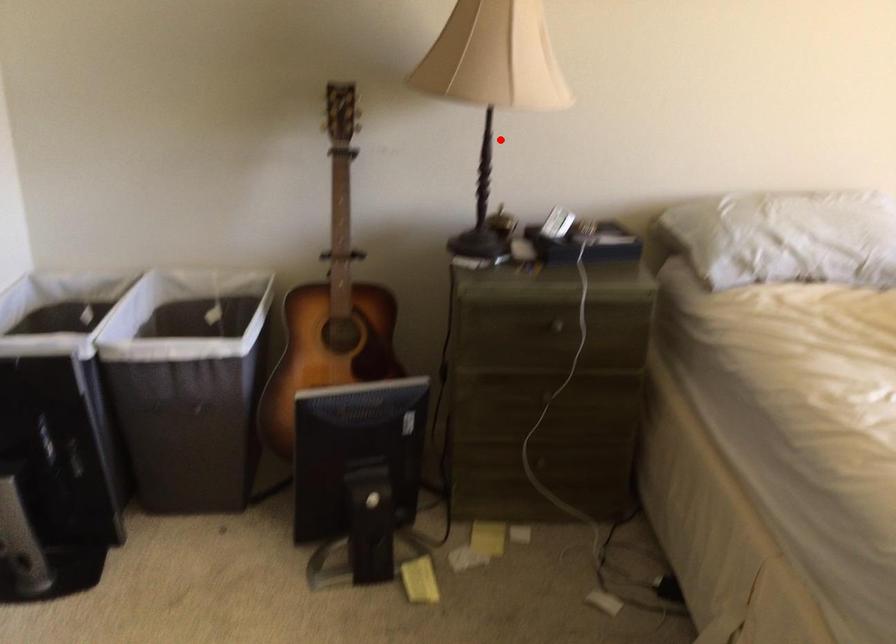
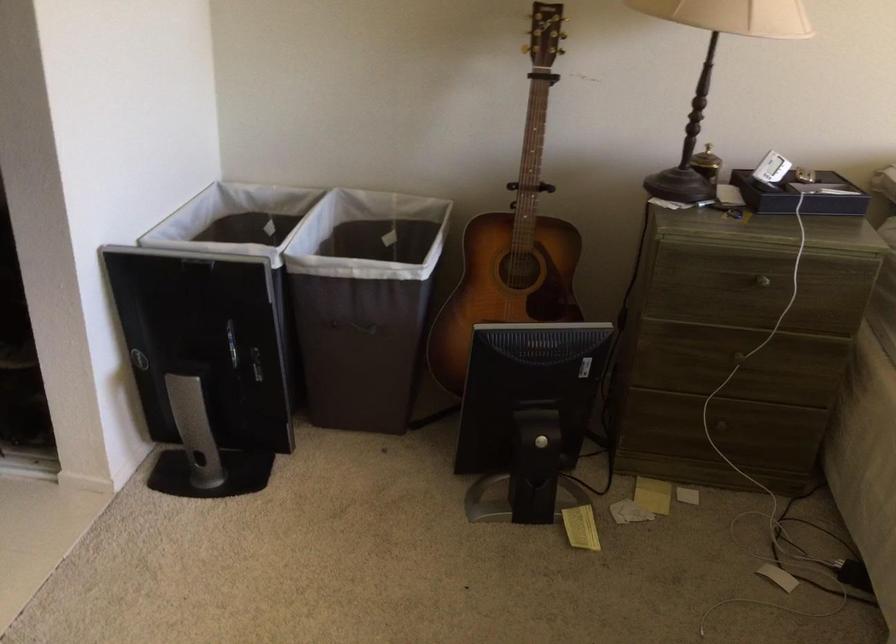
Where in the second image is the point corresponding to the highlighted location from the first image?

(714, 69)